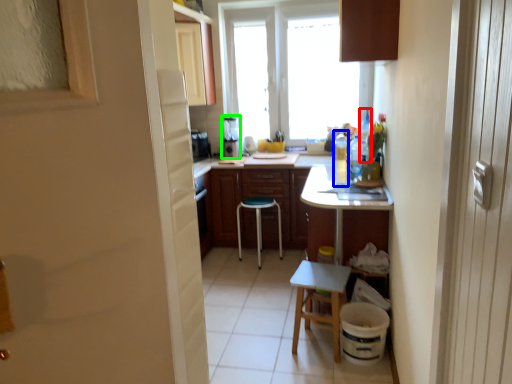
Question: Which is farther away from bottle (highlighted by a red box)? bottle (highlighted by a blue box) or appliance (highlighted by a green box)?

Choices:
 (A) bottle
 (B) appliance

Answer: (B)